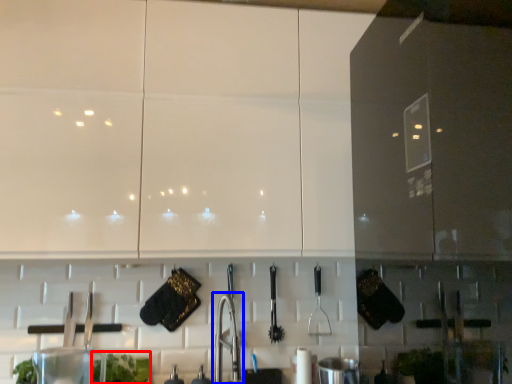
Question: Which object appears farthest to the camera in this image, plant (highlighted by a red box) or faucet (highlighted by a blue box)?

Choices:
 (A) plant
 (B) faucet

Answer: (A)